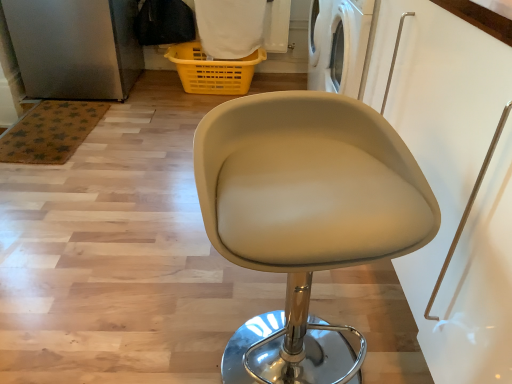
Question: From a real-world perspective, is beige leather stool at center located higher than yellow plastic basket at upper center?

Choices:
 (A) no
 (B) yes

Answer: (B)

Question: Is there a large distance between beige leather stool at center and yellow plastic basket at upper center?

Choices:
 (A) no
 (B) yes

Answer: (B)

Question: Is beige leather stool at center to the right of yellow plastic basket at upper center from the viewer's perspective?

Choices:
 (A) no
 (B) yes

Answer: (B)

Question: Does beige leather stool at center have a greater height compared to yellow plastic basket at upper center?

Choices:
 (A) yes
 (B) no

Answer: (A)

Question: Considering the relative sizes of beige leather stool at center and yellow plastic basket at upper center in the image provided, is beige leather stool at center bigger than yellow plastic basket at upper center?

Choices:
 (A) yes
 (B) no

Answer: (A)

Question: Is yellow plastic basket at upper center completely or partially inside beige leather stool at center?

Choices:
 (A) no
 (B) yes

Answer: (A)

Question: Does yellow plastic basket at upper center appear on the left side of beige leather stool at center?

Choices:
 (A) no
 (B) yes

Answer: (B)

Question: Can you confirm if yellow plastic basket at upper center is bigger than beige leather stool at center?

Choices:
 (A) no
 (B) yes

Answer: (A)

Question: Considering the relative sizes of yellow plastic basket at upper center and beige leather stool at center in the image provided, is yellow plastic basket at upper center shorter than beige leather stool at center?

Choices:
 (A) no
 (B) yes

Answer: (B)

Question: From a real-world perspective, is yellow plastic basket at upper center on top of beige leather stool at center?

Choices:
 (A) yes
 (B) no

Answer: (B)

Question: Is beige leather stool at center a part of yellow plastic basket at upper center?

Choices:
 (A) yes
 (B) no

Answer: (B)

Question: Are yellow plastic basket at upper center and beige leather stool at center located far from each other?

Choices:
 (A) yes
 (B) no

Answer: (A)

Question: Is yellow plastic basket at upper center wider or thinner than beige leather stool at center?

Choices:
 (A) thin
 (B) wide

Answer: (A)